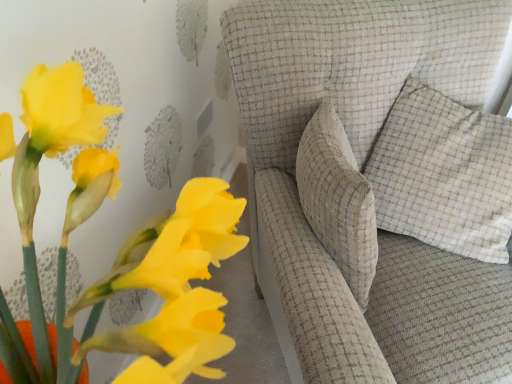
Question: Considering their positions, is beige checkered pillow at upper right located in front of or behind textured beige sofa at center?

Choices:
 (A) behind
 (B) front

Answer: (A)

Question: From a real-world perspective, is beige checkered pillow at upper right above or below textured beige sofa at center?

Choices:
 (A) below
 (B) above

Answer: (B)

Question: Based on their relative distances, which object is farther from the textured beige sofa at center?

Choices:
 (A) beige checkered pillow at upper right
 (B) matte yellow flowers at lower left

Answer: (B)

Question: Considering the real-world distances, which object is closest to the beige checkered pillow at upper right?

Choices:
 (A) textured beige sofa at center
 (B) matte yellow flowers at lower left

Answer: (A)